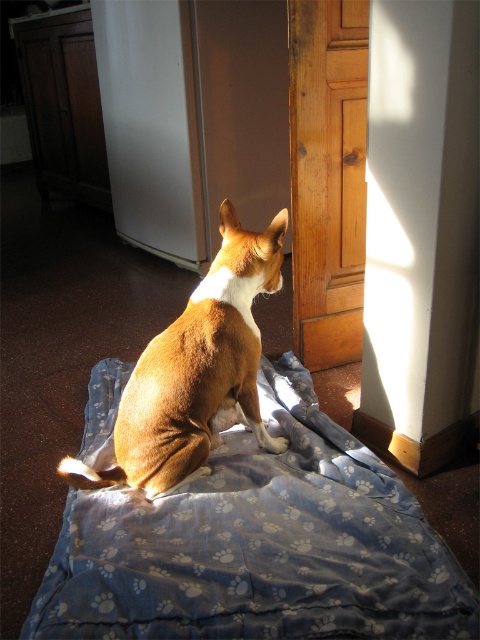
Is blue fabric sheet at center shorter than brown furry dog at center?

Yes.

What do you see at coordinates (259, 545) in the screenshot? I see `blue fabric sheet at center` at bounding box center [259, 545].

Between point (235, 536) and point (60, 474), which one is positioned in front?

Positioned in front is point (235, 536).

Where is `blue fabric sheet at center`? This screenshot has width=480, height=640. blue fabric sheet at center is located at coordinates (259, 545).